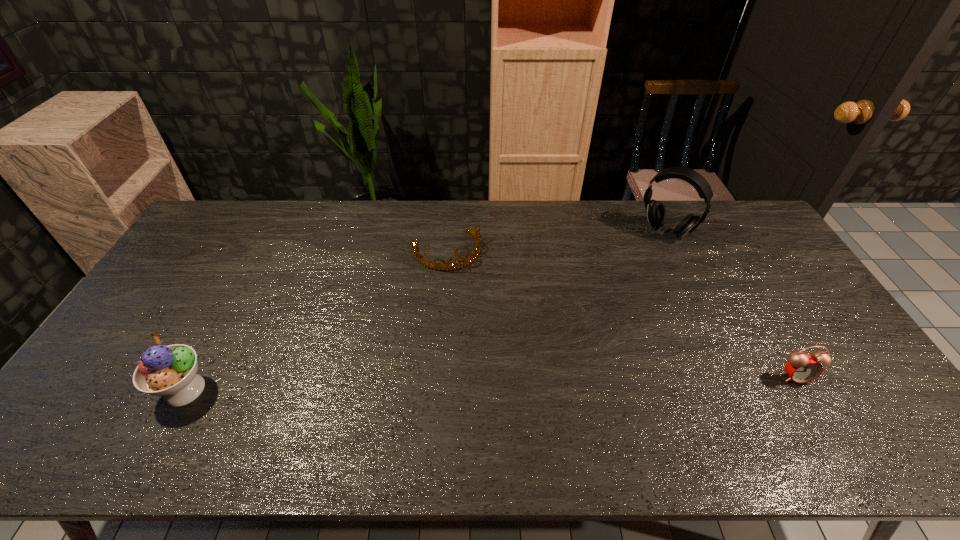
Find the location of a particular element. This screenshot has height=540, width=960. vacant area between the shortest object and the tallest object is located at coordinates (556, 241).

Locate an element on the screen. This screenshot has width=960, height=540. vacant space that's between the leftmost object and the shortest object is located at coordinates (316, 320).

Locate an element on the screen. This screenshot has width=960, height=540. free space that is in between the alarm clock and the second object from left to right is located at coordinates (621, 314).

What are the coordinates of `free spot between the alarm clock and the second tallest object` in the screenshot? It's located at click(x=490, y=383).

This screenshot has width=960, height=540. I want to click on vacant space that's between the third shortest object and the tiara, so click(316, 320).

You are a GUI agent. You are given a task and a screenshot of the screen. Output one action in this format:
    pyautogui.click(x=<x>, y=<y>)
    Task: Click on the empty location between the tallest object and the tiara
    
    Given the screenshot: What is the action you would take?
    pyautogui.click(x=556, y=241)

This screenshot has height=540, width=960. I want to click on free space between the leftmost object and the shortest object, so click(316, 320).

Image resolution: width=960 pixels, height=540 pixels. Find the location of `the third closest object to the earphone`. the third closest object to the earphone is located at coordinates (170, 371).

Select which object is the third closest to the shortest object. Please provide its 2D coordinates. Your answer should be formatted as a tuple, i.e. [(x, y)], where the tuple contains the x and y coordinates of a point satisfying the conditions above.

[(802, 368)]

Where is `vacant point that satisfies the following two spatial constraints: 1. on the back side of the shortest object; 2. on the left side of the earphone`? The image size is (960, 540). vacant point that satisfies the following two spatial constraints: 1. on the back side of the shortest object; 2. on the left side of the earphone is located at coordinates (448, 231).